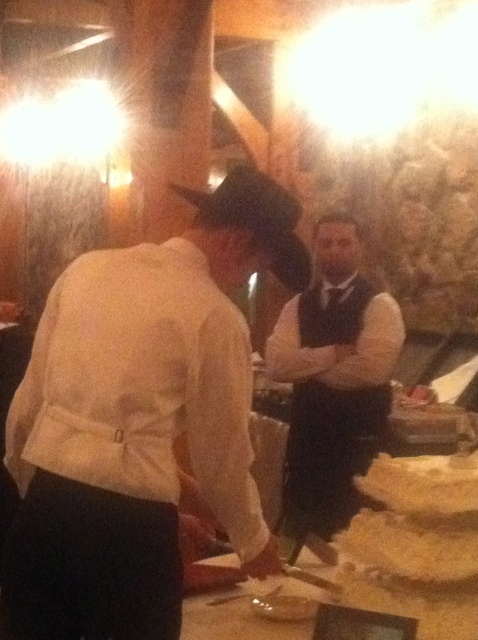
Is white matte hat at upper left positioned before dark brown leather vest at center?

Yes, white matte hat at upper left is in front of dark brown leather vest at center.

Which is below, white matte hat at upper left or dark brown leather vest at center?

Positioned lower is dark brown leather vest at center.

Measure the distance between point (93, 612) and camera.

Point (93, 612) and camera are 3.93 feet apart.

Identify the location of white matte hat at upper left. The height and width of the screenshot is (640, 478). (141, 420).

Is white matte hat at upper left to the right of golden crumbly pastry at lower center from the viewer's perspective?

Incorrect, white matte hat at upper left is not on the right side of golden crumbly pastry at lower center.

Between white matte hat at upper left and golden crumbly pastry at lower center, which one has less height?

With less height is golden crumbly pastry at lower center.

At what (x,y) coordinates should I click in order to perform the action: click on white matte hat at upper left. Please return your answer as a coordinate pair (x, y). Looking at the image, I should click on (141, 420).

Where is `white matte hat at upper left`? white matte hat at upper left is located at coordinates (141, 420).

Is golden crumbly pastry at lower right smaller than golden crispy bread at lower right?

No.

Between point (427, 525) and point (425, 483), which one is positioned behind?

Point (427, 525)

Image resolution: width=478 pixels, height=640 pixels. What are the coordinates of `golden crumbly pastry at lower right` in the screenshot? It's located at (416, 544).

At what (x,y) coordinates should I click in order to perform the action: click on golden crumbly pastry at lower right. Please return your answer as a coordinate pair (x, y). The width and height of the screenshot is (478, 640). Looking at the image, I should click on (416, 544).